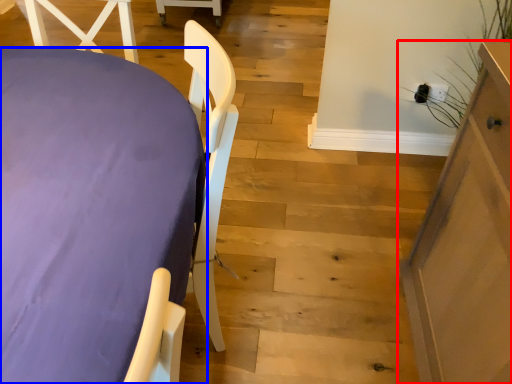
Question: Which object appears closest to the camera in this image, furniture (highlighted by a red box) or furniture (highlighted by a blue box)?

Choices:
 (A) furniture
 (B) furniture

Answer: (B)